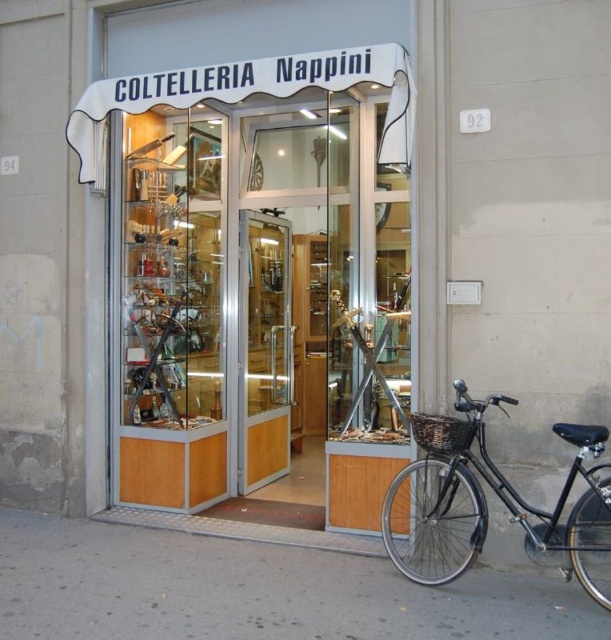
You are a customer standing outside the shop and want to see the knives inside the wooden display case at center. Can you see the black matte bicycle at lower right from your current position?

The black matte bicycle at lower right is behind the wooden display case at center, so you cannot see the black matte bicycle at lower right from your current position outside the shop.

You are a delivery person who needs to park your delivery van next to the gray concrete pavement at lower center and the black matte bicycle at lower right. Can you fit your van between them if the van is 2.5 meters wide?

The gray concrete pavement at lower center is wider than the black matte bicycle at lower right. However, the exact width difference isn